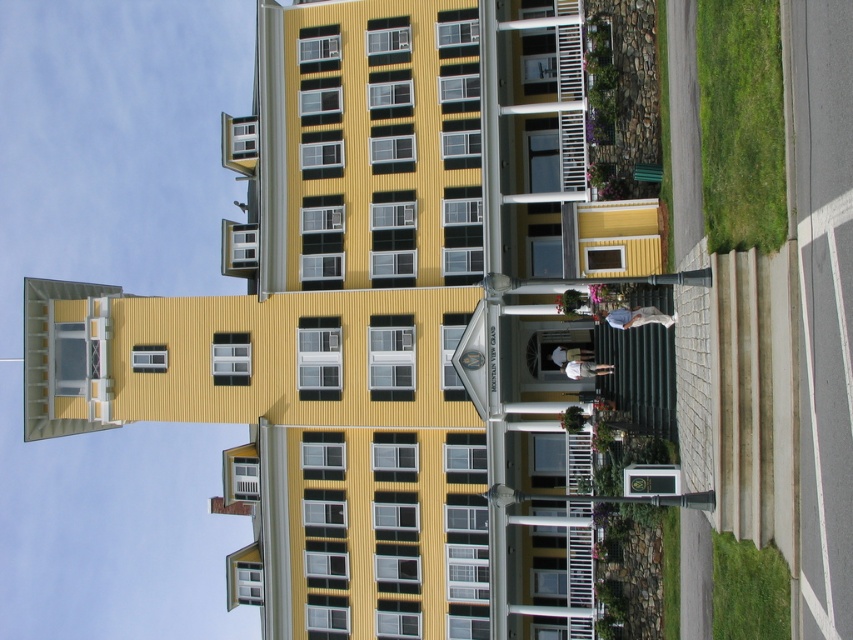
Question: Which point is closer to the camera?

Choices:
 (A) green grass at right
 (B) green grass at lower right

Answer: (B)

Question: Is green grass at right in front of green grass at lower right?

Choices:
 (A) no
 (B) yes

Answer: (A)

Question: Which point is farther to the camera?

Choices:
 (A) (x=709, y=35)
 (B) (x=782, y=636)

Answer: (A)

Question: Is green grass at right to the left of green grass at lower right from the viewer's perspective?

Choices:
 (A) no
 (B) yes

Answer: (A)

Question: Does green grass at right lie behind green grass at lower right?

Choices:
 (A) no
 (B) yes

Answer: (B)